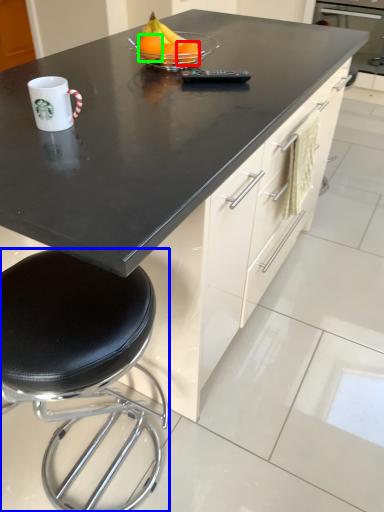
Question: Which object is the closest to the orange (highlighted by a red box)? Choose among these: stool (highlighted by a blue box) or orange (highlighted by a green box).

Choices:
 (A) stool
 (B) orange

Answer: (B)